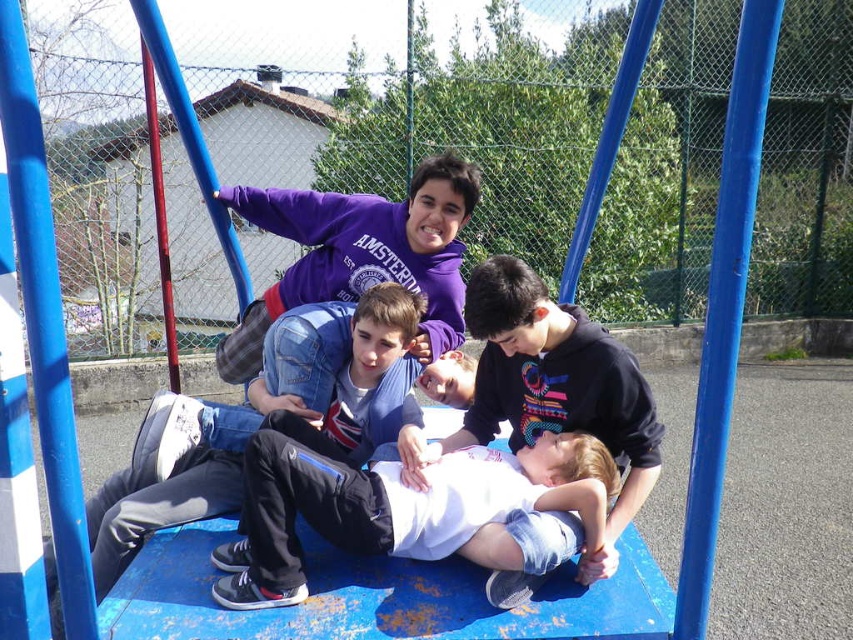
Question: Does white matte shirt at center appear over denim jacket at center?

Choices:
 (A) no
 (B) yes

Answer: (B)

Question: Which point is closer to the camera?

Choices:
 (A) white matte shirt at center
 (B) denim jacket at center
 (C) white cotton shirt at center

Answer: (C)

Question: Can you confirm if white matte shirt at center is bigger than denim jacket at center?

Choices:
 (A) no
 (B) yes

Answer: (B)

Question: Which point appears closest to the camera in this image?

Choices:
 (A) (583, 368)
 (B) (329, 344)

Answer: (A)

Question: Can you confirm if white cotton shirt at center is positioned to the right of white matte shirt at center?

Choices:
 (A) yes
 (B) no

Answer: (B)

Question: Which of these objects is positioned closest to the white matte shirt at center?

Choices:
 (A) white cotton shirt at center
 (B) denim jacket at center

Answer: (A)